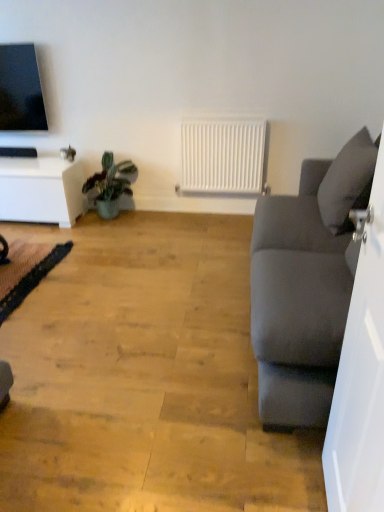
Question: Considering the relative sizes of black lace yoga mat at lower left and gray fabric pillow at right in the image provided, is black lace yoga mat at lower left bigger than gray fabric pillow at right?

Choices:
 (A) yes
 (B) no

Answer: (B)

Question: Does black lace yoga mat at lower left lie behind gray fabric pillow at right?

Choices:
 (A) no
 (B) yes

Answer: (B)

Question: From the image's perspective, is black lace yoga mat at lower left on gray fabric pillow at right?

Choices:
 (A) yes
 (B) no

Answer: (B)

Question: Can you confirm if black lace yoga mat at lower left is wider than gray fabric pillow at right?

Choices:
 (A) yes
 (B) no

Answer: (A)

Question: From a real-world perspective, is black lace yoga mat at lower left over gray fabric pillow at right?

Choices:
 (A) no
 (B) yes

Answer: (A)

Question: In terms of size, does green matte plant at lower left appear bigger or smaller than gray fabric pillow at right?

Choices:
 (A) big
 (B) small

Answer: (B)

Question: Is point (110, 170) positioned closer to the camera than point (357, 192)?

Choices:
 (A) closer
 (B) farther

Answer: (B)

Question: From a real-world perspective, is green matte plant at lower left physically located above or below gray fabric pillow at right?

Choices:
 (A) below
 (B) above

Answer: (A)

Question: In terms of width, does green matte plant at lower left look wider or thinner when compared to gray fabric pillow at right?

Choices:
 (A) thin
 (B) wide

Answer: (B)

Question: From their relative heights in the image, would you say white glossy table at left is taller or shorter than gray fabric pillow at right?

Choices:
 (A) tall
 (B) short

Answer: (B)

Question: Is white glossy table at left to the left or to the right of gray fabric pillow at right in the image?

Choices:
 (A) right
 (B) left

Answer: (B)

Question: In the image, is white glossy table at left positioned in front of or behind gray fabric pillow at right?

Choices:
 (A) behind
 (B) front

Answer: (A)

Question: Considering the positions of white glossy table at left and gray fabric pillow at right in the image, is white glossy table at left bigger or smaller than gray fabric pillow at right?

Choices:
 (A) small
 (B) big

Answer: (B)

Question: Considering their positions, is white glossy table at left located in front of or behind matte gray couch at right?

Choices:
 (A) front
 (B) behind

Answer: (B)

Question: In the image, is white glossy table at left on the left side or the right side of matte gray couch at right?

Choices:
 (A) left
 (B) right

Answer: (A)